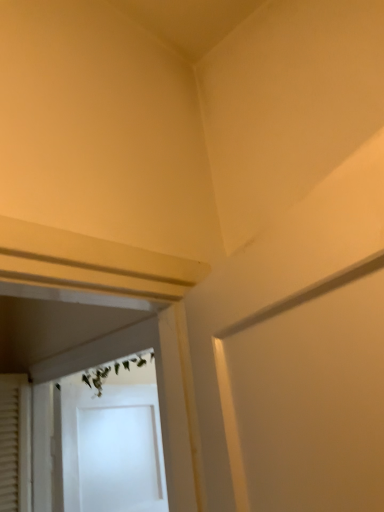
Question: Should I look upward or downward to see white glossy screen door at center?

Choices:
 (A) up
 (B) down

Answer: (B)